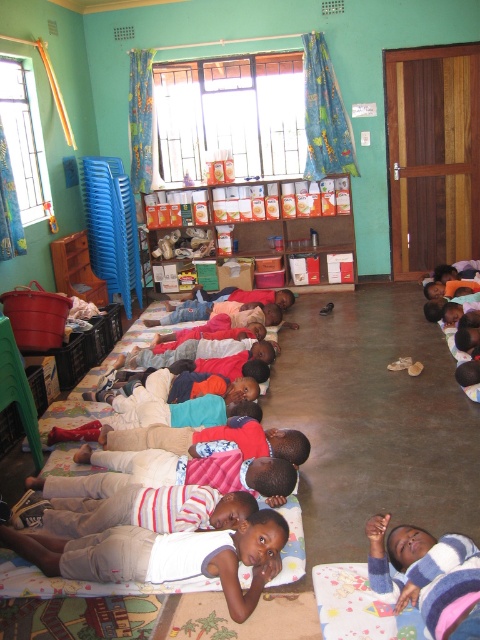
You are a teacher organizing a classroom activity. You need to determine which clothing item is larger between the light brown cotton shorts at center and the striped knit sweater at lower right. Which one should you choose if you need a larger item for a demonstration?

The light brown cotton shorts at center is bigger than the striped knit sweater at lower right, so you should choose the light brown cotton shorts at center for the demonstration.

You are a teacher observing the classroom. You notice the light brown cotton shorts at center and the striped knit sweater at lower right. Which object is taller?

The light brown cotton shorts at center is taller than the striped knit sweater at lower right.

You are a teacher in the classroom and need to find a child wearing the striped knit sweater at lower right. Based on the scene description, where should you look relative to the light brown cotton shorts at center?

The striped knit sweater at lower right is on the right side of the light brown cotton shorts at center, so you should look to the right of the light brown cotton shorts at center to find the child wearing the striped knit sweater at lower right.